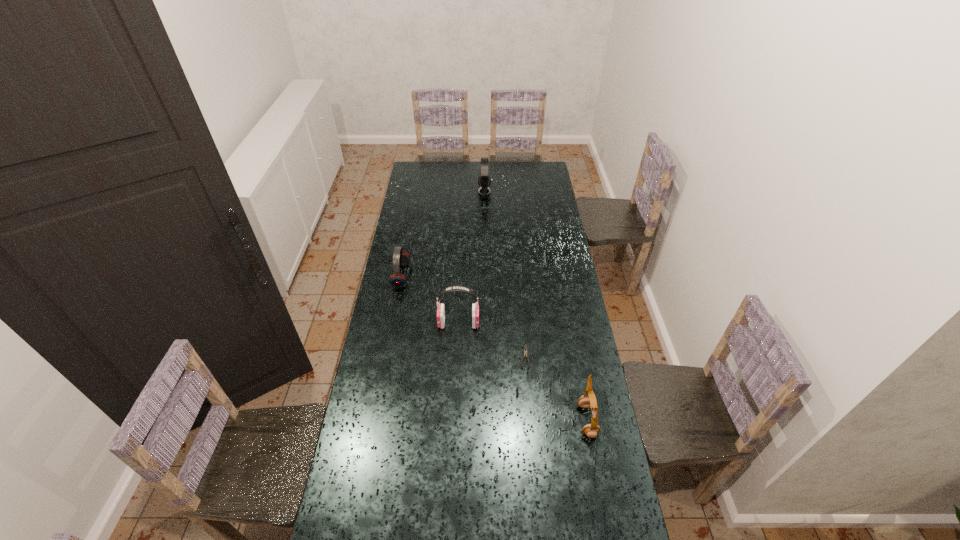
Where is `vacant space at the left edge`? This screenshot has height=540, width=960. vacant space at the left edge is located at coordinates (403, 358).

In the image, there is a desktop. Find the location of `vacant space at the right edge`. vacant space at the right edge is located at coordinates (572, 285).

Image resolution: width=960 pixels, height=540 pixels. In order to click on free spot at the far left corner of the desktop in this screenshot , I will do `click(434, 172)`.

Image resolution: width=960 pixels, height=540 pixels. Identify the location of vacant area that lies between the farthest earphone and the leftmost earphone. (443, 234).

Locate an element on the screen. The width and height of the screenshot is (960, 540). vacant area that lies between the farthest earphone and the pliers is located at coordinates [x=505, y=274].

Image resolution: width=960 pixels, height=540 pixels. I want to click on vacant area between the pliers and the nearest object, so tap(556, 388).

Image resolution: width=960 pixels, height=540 pixels. What are the coordinates of `free space between the shortest object and the farthest earphone` in the screenshot? It's located at pos(505,274).

You are a GUI agent. You are given a task and a screenshot of the screen. Output one action in this format:
    pyautogui.click(x=<x>, y=<y>)
    Task: Click on the empty space that is in between the nearest earphone and the second nearest earphone
    
    Given the screenshot: What is the action you would take?
    pyautogui.click(x=523, y=372)

The image size is (960, 540). I want to click on vacant area between the rightmost earphone and the farthest earphone, so (536, 306).

Locate an element on the screen. free space between the shortest object and the rightmost object is located at coordinates (556, 388).